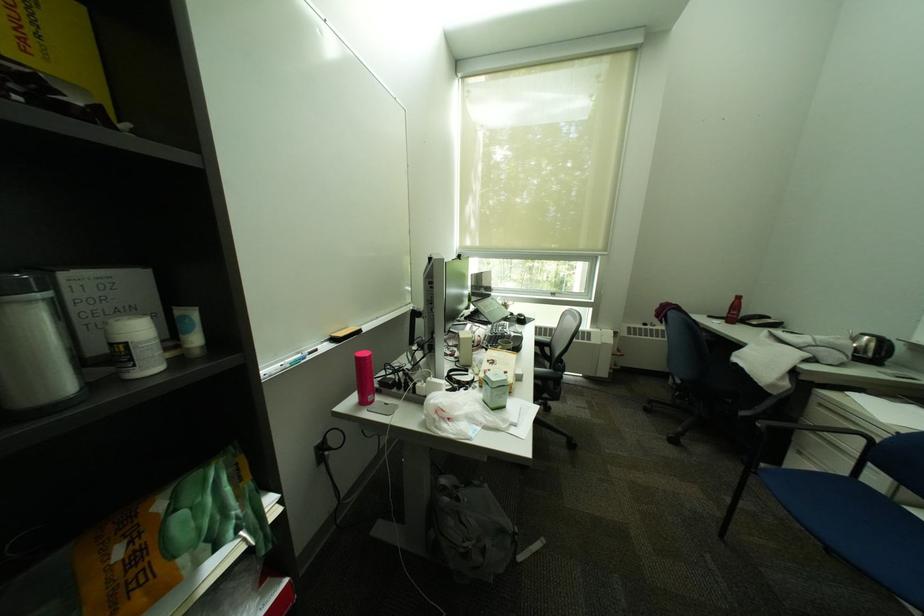
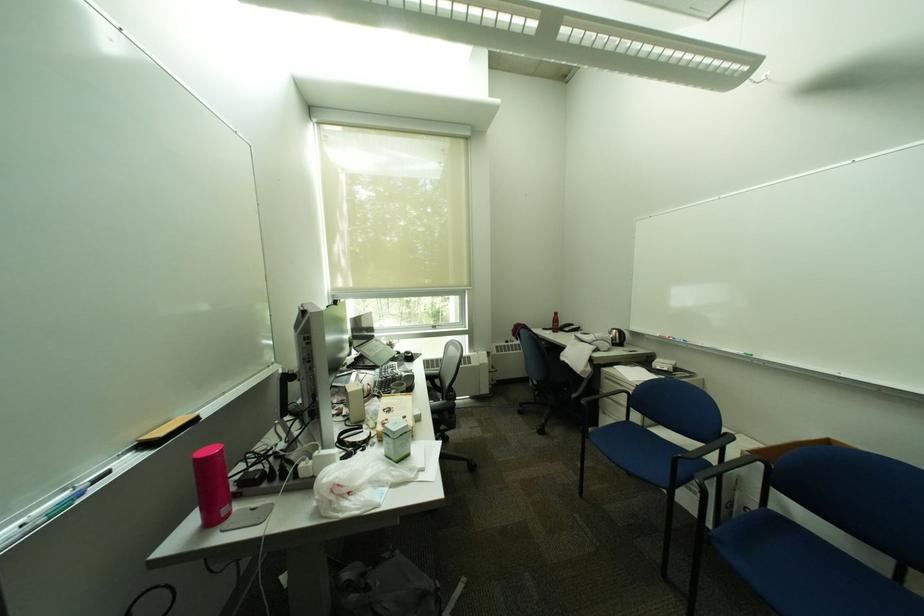
Question: The camera is either moving clockwise (left) or counter-clockwise (right) around the object. The first image is from the beginning of the video and the second image is from the end. Is the camera moving left or right when shooting the video?

Choices:
 (A) Left
 (B) Right

Answer: (A)